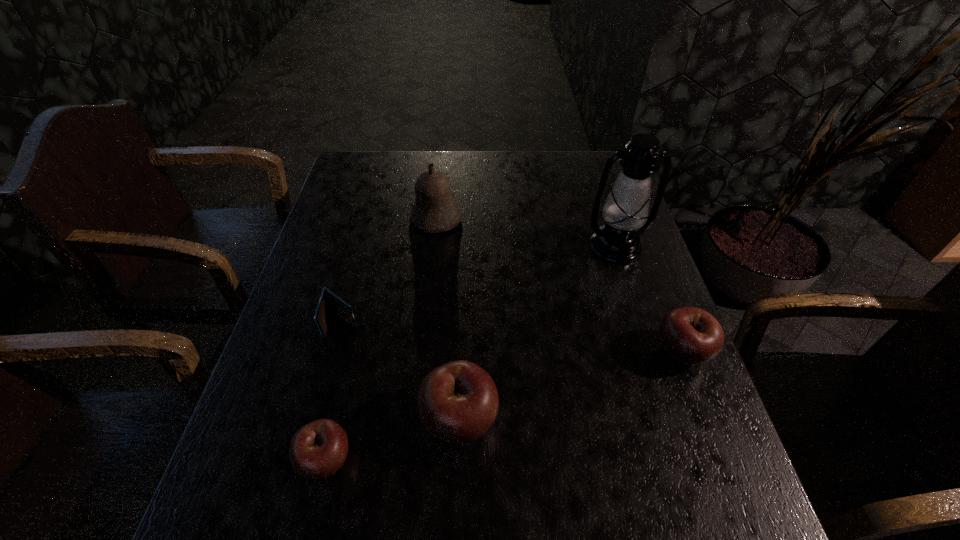
Where is `blank region between the wallet and the bell`? The width and height of the screenshot is (960, 540). blank region between the wallet and the bell is located at coordinates (389, 272).

The width and height of the screenshot is (960, 540). Find the location of `free point between the shortest apple and the second apple from right to left`. free point between the shortest apple and the second apple from right to left is located at coordinates (393, 439).

Where is `free point between the oil lamp and the wallet`? Image resolution: width=960 pixels, height=540 pixels. free point between the oil lamp and the wallet is located at coordinates (479, 285).

Identify the location of empty location between the wallet and the second apple from right to left. (401, 372).

Locate an element on the screen. free point between the wallet and the shortest apple is located at coordinates (334, 392).

This screenshot has height=540, width=960. What are the coordinates of `vacant space in between the leftmost apple and the oil lamp` in the screenshot? It's located at (470, 353).

Identify which object is located as the nearest to the bell. Please provide its 2D coordinates. Your answer should be formatted as a tuple, i.e. [(x, y)], where the tuple contains the x and y coordinates of a point satisfying the conditions above.

[(328, 302)]

At what (x,y) coordinates should I click in order to perform the action: click on object that ranks as the third closest to the wallet. Please return your answer as a coordinate pair (x, y). Image resolution: width=960 pixels, height=540 pixels. Looking at the image, I should click on (434, 210).

This screenshot has width=960, height=540. Identify the location of apple that is the second closest to the fourth shortest object. (691, 336).

Identify which apple is the closest to the shortest apple. Please provide its 2D coordinates. Your answer should be formatted as a tuple, i.e. [(x, y)], where the tuple contains the x and y coordinates of a point satisfying the conditions above.

[(458, 402)]